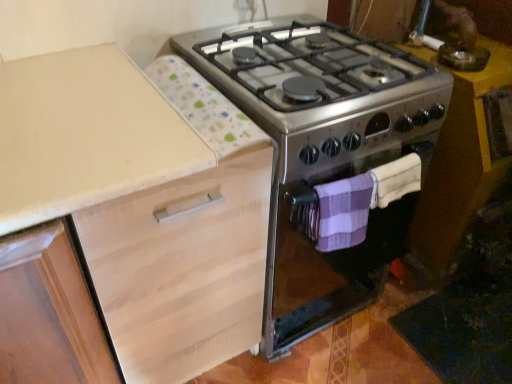
Describe the element at coordinates (139, 208) in the screenshot. Image resolution: width=512 pixels, height=384 pixels. I see `light wood cabinet at upper left` at that location.

What are the coordinates of `purple striped towel at lower right, placed as the 1th blanket when sorted from left to right` in the screenshot? It's located at (344, 212).

Who is bigger, metallic yellow table at right or purple knitted towel at lower right, acting as the first blanket starting from the right?

metallic yellow table at right is bigger.

Which of these two, metallic yellow table at right or purple knitted towel at lower right, which is counted as the 2th blanket, starting from the left, stands taller?

Standing taller between the two is metallic yellow table at right.

From a real-world perspective, count 2nd blankets upward from the metallic yellow table at right and point to it. Please provide its 2D coordinates.

[(395, 180)]

From the image's perspective, is metallic yellow table at right located above or below purple knitted towel at lower right, which is counted as the 2th blanket, starting from the left?

metallic yellow table at right is above purple knitted towel at lower right, which is counted as the 2th blanket, starting from the left.

Does purple knitted towel at lower right, which is counted as the 2th blanket, starting from the left, have a lesser width compared to purple striped towel at lower right, arranged as the second blanket when viewed from the right?

Indeed, purple knitted towel at lower right, which is counted as the 2th blanket, starting from the left, has a lesser width compared to purple striped towel at lower right, arranged as the second blanket when viewed from the right.

Does purple knitted towel at lower right, which is counted as the 2th blanket, starting from the left, touch purple striped towel at lower right, arranged as the second blanket when viewed from the right?

Indeed, purple knitted towel at lower right, which is counted as the 2th blanket, starting from the left, and purple striped towel at lower right, arranged as the second blanket when viewed from the right, are beside each other and touching.

Considering the relative positions of purple knitted towel at lower right, acting as the first blanket starting from the right, and purple striped towel at lower right, placed as the 1th blanket when sorted from left to right, in the image provided, is purple knitted towel at lower right, acting as the first blanket starting from the right, to the left or to the right of purple striped towel at lower right, placed as the 1th blanket when sorted from left to right,?

In the image, purple knitted towel at lower right, acting as the first blanket starting from the right, appears on the right side of purple striped towel at lower right, placed as the 1th blanket when sorted from left to right.

Is purple knitted towel at lower right, which is counted as the 2th blanket, starting from the left, aimed at purple striped towel at lower right, placed as the 1th blanket when sorted from left to right?

No, purple knitted towel at lower right, which is counted as the 2th blanket, starting from the left, is not oriented towards purple striped towel at lower right, placed as the 1th blanket when sorted from left to right.

Are purple striped towel at lower right, arranged as the second blanket when viewed from the right, and stainless steel stove at center far apart?

That's not correct — purple striped towel at lower right, arranged as the second blanket when viewed from the right, is a little close to stainless steel stove at center.

Is purple striped towel at lower right, arranged as the second blanket when viewed from the right, positioned with its back to stainless steel stove at center?

Absolutely, purple striped towel at lower right, arranged as the second blanket when viewed from the right, is directed away from stainless steel stove at center.

Looking at their sizes, would you say purple striped towel at lower right, arranged as the second blanket when viewed from the right, is wider or thinner than stainless steel stove at center?

Considering their sizes, purple striped towel at lower right, arranged as the second blanket when viewed from the right, looks slimmer than stainless steel stove at center.

Is purple striped towel at lower right, arranged as the second blanket when viewed from the right, bigger than stainless steel stove at center?

No, purple striped towel at lower right, arranged as the second blanket when viewed from the right, is not bigger than stainless steel stove at center.

Are stainless steel stove at center and purple knitted towel at lower right, acting as the first blanket starting from the right, beside each other?

stainless steel stove at center and purple knitted towel at lower right, acting as the first blanket starting from the right, are not in contact.

You are a GUI agent. You are given a task and a screenshot of the screen. Output one action in this format:
    pyautogui.click(x=<x>, y=<y>)
    Task: Click on the appliance in front of the purple knitted towel at lower right, acting as the first blanket starting from the right
    Image resolution: width=512 pixels, height=384 pixels.
    Given the screenshot: What is the action you would take?
    pyautogui.click(x=324, y=150)

Can you confirm if stainless steel stove at center is taller than purple knitted towel at lower right, which is counted as the 2th blanket, starting from the left?

Yes.

Who is smaller, metallic yellow table at right or stainless steel stove at center?

Smaller between the two is metallic yellow table at right.

Is point (425, 55) behind point (311, 122)?

Yes.

What are the coordinates of `table that is on the right side of stainless steel stove at center` in the screenshot? It's located at (461, 167).

Is metallic yellow table at right situated inside stainless steel stove at center or outside?

metallic yellow table at right exists outside the volume of stainless steel stove at center.

Is stainless steel stove at center far away from light wood cabinet at upper left?

No, stainless steel stove at center is not far away from light wood cabinet at upper left.

Which of these two, stainless steel stove at center or light wood cabinet at upper left, is wider?

stainless steel stove at center is wider.

Can you tell me how much stainless steel stove at center and light wood cabinet at upper left differ in facing direction?

They differ by 9.87e-05 degrees in their facing directions.

In the scene shown: Is purple knitted towel at lower right, acting as the first blanket starting from the right, looking in the opposite direction of light wood cabinet at upper left?

No, light wood cabinet at upper left is not at the back of purple knitted towel at lower right, acting as the first blanket starting from the right.

Is purple knitted towel at lower right, acting as the first blanket starting from the right, next to light wood cabinet at upper left?

No.

Is point (402, 186) less distant than point (8, 160)?

That is False.

Can you confirm if purple knitted towel at lower right, which is counted as the 2th blanket, starting from the left, is positioned to the right of light wood cabinet at upper left?

Correct, you'll find purple knitted towel at lower right, which is counted as the 2th blanket, starting from the left, to the right of light wood cabinet at upper left.

Image resolution: width=512 pixels, height=384 pixels. What are the coordinates of `table above the purple knitted towel at lower right, acting as the first blanket starting from the right (from the image's perspective)` in the screenshot? It's located at (461, 167).

Locate an element on the screen. The image size is (512, 384). blanket that is in front of the purple knitted towel at lower right, acting as the first blanket starting from the right is located at coordinates (344, 212).

Based on their spatial positions, is metallic yellow table at right or light wood cabinet at upper left closer to stainless steel stove at center?

Among the two, light wood cabinet at upper left is located nearer to stainless steel stove at center.

Based on their spatial positions, is metallic yellow table at right or purple knitted towel at lower right, which is counted as the 2th blanket, starting from the left, closer to stainless steel stove at center?

purple knitted towel at lower right, which is counted as the 2th blanket, starting from the left, lies closer to stainless steel stove at center than the other object.

Considering their positions, is stainless steel stove at center positioned closer to purple knitted towel at lower right, which is counted as the 2th blanket, starting from the left, than light wood cabinet at upper left?

stainless steel stove at center is positioned closer to the anchor purple knitted towel at lower right, which is counted as the 2th blanket, starting from the left.

Which object lies nearer to the anchor point stainless steel stove at center, light wood cabinet at upper left or purple striped towel at lower right, arranged as the second blanket when viewed from the right?

Among the two, purple striped towel at lower right, arranged as the second blanket when viewed from the right, is located nearer to stainless steel stove at center.

When comparing their distances from purple knitted towel at lower right, acting as the first blanket starting from the right, does purple striped towel at lower right, placed as the 1th blanket when sorted from left to right, or light wood cabinet at upper left seem further?

Among the two, light wood cabinet at upper left is located further to purple knitted towel at lower right, acting as the first blanket starting from the right.

Looking at this image, which object lies nearer to the anchor point purple striped towel at lower right, placed as the 1th blanket when sorted from left to right, metallic yellow table at right or stainless steel stove at center?

Based on the image, stainless steel stove at center appears to be nearer to purple striped towel at lower right, placed as the 1th blanket when sorted from left to right.

Considering their positions, is purple knitted towel at lower right, which is counted as the 2th blanket, starting from the left, positioned closer to purple striped towel at lower right, placed as the 1th blanket when sorted from left to right, than light wood cabinet at upper left?

The object closer to purple striped towel at lower right, placed as the 1th blanket when sorted from left to right, is purple knitted towel at lower right, which is counted as the 2th blanket, starting from the left.

When comparing their distances from metallic yellow table at right, does purple knitted towel at lower right, which is counted as the 2th blanket, starting from the left, or purple striped towel at lower right, arranged as the second blanket when viewed from the right, seem further?

purple striped towel at lower right, arranged as the second blanket when viewed from the right.

Find the location of a particular element. blanket located between stainless steel stove at center and purple knitted towel at lower right, acting as the first blanket starting from the right, in the left-right direction is located at coordinates (344, 212).

Find the location of a particular element. This screenshot has height=384, width=512. appliance between light wood cabinet at upper left and purple striped towel at lower right, arranged as the second blanket when viewed from the right, from left to right is located at coordinates (324, 150).

You are a GUI agent. You are given a task and a screenshot of the screen. Output one action in this format:
    pyautogui.click(x=<x>, y=<y>)
    Task: Click on the appliance between light wood cabinet at upper left and metallic yellow table at right in the horizontal direction
    The width and height of the screenshot is (512, 384).
    Given the screenshot: What is the action you would take?
    pyautogui.click(x=324, y=150)

At what (x,y) coordinates should I click in order to perform the action: click on appliance located between light wood cabinet at upper left and purple knitted towel at lower right, acting as the first blanket starting from the right, in the left-right direction. Please return your answer as a coordinate pair (x, y). This screenshot has width=512, height=384. Looking at the image, I should click on (324, 150).